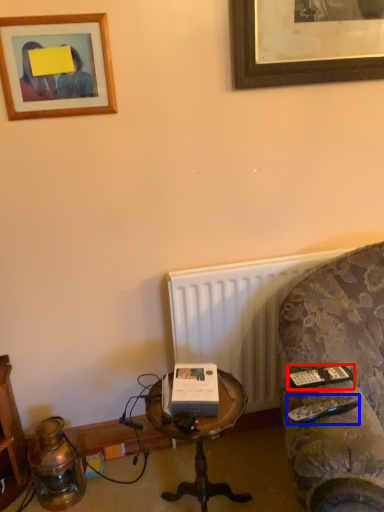
Question: Among these objects, which one is farthest to the camera, remote (highlighted by a red box) or remote (highlighted by a blue box)?

Choices:
 (A) remote
 (B) remote

Answer: (A)